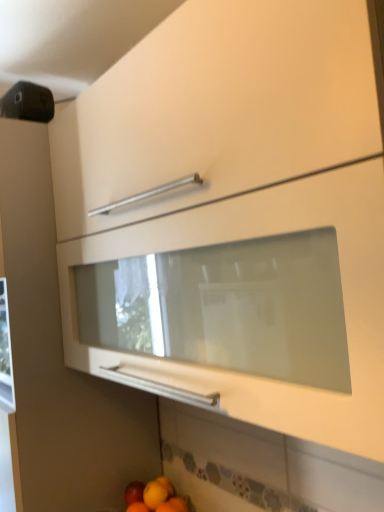
The image size is (384, 512). What do you see at coordinates (154, 494) in the screenshot? I see `matte orange at lower center` at bounding box center [154, 494].

Measure the distance between point (x=148, y=503) and camera.

Point (x=148, y=503) is 1.28 meters away from camera.

The image size is (384, 512). Identify the location of matte orange at lower center. (154, 494).

The height and width of the screenshot is (512, 384). Describe the element at coordinates (134, 492) in the screenshot. I see `matte red apple at lower left` at that location.

Locate an element on the screen. The width and height of the screenshot is (384, 512). matte red apple at lower left is located at coordinates (134, 492).

What is the approximate height of matte red apple at lower left?

matte red apple at lower left is 2.38 inches in height.

The width and height of the screenshot is (384, 512). What are the coordinates of `matte orange at lower center` in the screenshot? It's located at (154, 494).

Considering the positions of objects matte orange at lower center and matte red apple at lower left in the image provided, who is more to the left, matte orange at lower center or matte red apple at lower left?

From the viewer's perspective, matte red apple at lower left appears more on the left side.

Is matte orange at lower center positioned in front of matte red apple at lower left?

Yes, the depth of matte orange at lower center is less than that of matte red apple at lower left.

Does point (146, 485) come in front of point (137, 493)?

No, (146, 485) is further to viewer.

From the image's perspective, would you say matte orange at lower center is positioned over matte red apple at lower left?

Indeed, from the image's perspective, matte orange at lower center is shown above matte red apple at lower left.

From a real-world perspective, is matte orange at lower center beneath matte red apple at lower left?

Actually, matte orange at lower center is physically above matte red apple at lower left in the real world.

Looking at their sizes, would you say matte orange at lower center is wider or thinner than matte red apple at lower left?

In the image, matte orange at lower center appears to be wider than matte red apple at lower left.

Can you confirm if matte orange at lower center is shorter than matte red apple at lower left?

No.

Between matte orange at lower center and matte red apple at lower left, which one has smaller size?

With smaller size is matte red apple at lower left.

Is matte orange at lower center completely or partially outside of matte red apple at lower left?

That's correct, matte orange at lower center is outside of matte red apple at lower left.

Are matte orange at lower center and matte red apple at lower left located far from each other?

That's not correct — matte orange at lower center is a little close to matte red apple at lower left.

Is matte orange at lower center looking in the opposite direction of matte red apple at lower left?

No, matte orange at lower center's orientation is not away from matte red apple at lower left.

How different are the orientations of matte orange at lower center and matte red apple at lower left in degrees?

They differ by 1.71 degrees in their facing directions.

Image resolution: width=384 pixels, height=512 pixels. Find the location of `apple below the matte orange at lower center (from a real-world perspective)`. apple below the matte orange at lower center (from a real-world perspective) is located at coordinates (134, 492).

Between matte red apple at lower left and matte orange at lower center, which one appears on the left side from the viewer's perspective?

matte red apple at lower left is more to the left.

Is the depth of matte red apple at lower left greater than that of matte orange at lower center?

Yes, it is behind matte orange at lower center.

Considering the points (136, 482) and (149, 486), which point is in front, point (136, 482) or point (149, 486)?

The point (149, 486) is more forward.

From the image's perspective, is matte red apple at lower left located above or below matte orange at lower center?

From the image's perspective, matte red apple at lower left appears below matte orange at lower center.

From a real-world perspective, between matte red apple at lower left and matte orange at lower center, who is vertically lower?

In real-world perspective, matte red apple at lower left is lower.

Considering the sizes of matte red apple at lower left and matte orange at lower center in the image, is matte red apple at lower left wider or thinner than matte orange at lower center?

Clearly, matte red apple at lower left has less width compared to matte orange at lower center.

Does matte red apple at lower left have a lesser height compared to matte orange at lower center?

Correct, matte red apple at lower left is not as tall as matte orange at lower center.

Between matte red apple at lower left and matte orange at lower center, which one has larger size?

matte orange at lower center is bigger.

Is matte orange at lower center completely or partially inside matte red apple at lower left?

Definitely not — matte orange at lower center is not inside matte red apple at lower left.

Is there a large distance between matte red apple at lower left and matte orange at lower center?

matte red apple at lower left is actually quite close to matte orange at lower center.

Is matte red apple at lower left oriented towards matte orange at lower center?

No.

Can you tell me how much matte red apple at lower left and matte orange at lower center differ in facing direction?

The angle between the facing direction of matte red apple at lower left and the facing direction of matte orange at lower center is 1.71 degrees.

Locate an element on the screen. apple below the matte orange at lower center (from the image's perspective) is located at coordinates (134, 492).

Locate an element on the screen. This screenshot has height=512, width=384. orange in front of the matte red apple at lower left is located at coordinates (154, 494).

In the image, there is a matte orange at lower center. Where is `apple below it (from the image's perspective)`? The height and width of the screenshot is (512, 384). apple below it (from the image's perspective) is located at coordinates (134, 492).